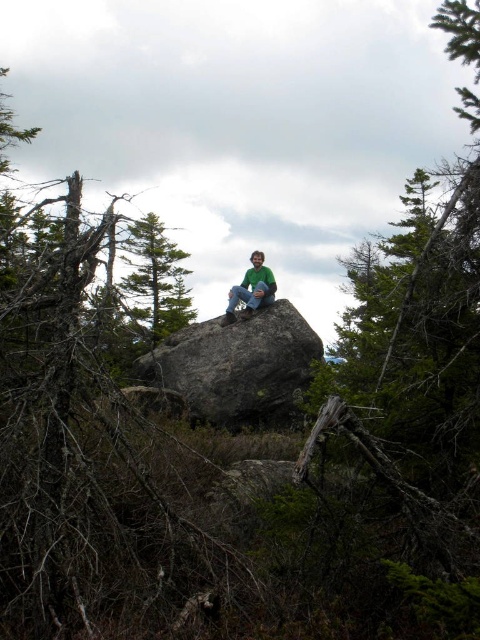
Is brown bark tree at center bigger than green textured pine tree at center?

Indeed, brown bark tree at center has a larger size compared to green textured pine tree at center.

Is point (154, 452) positioned before point (180, 291)?

Yes, it is.

Where is `brown bark tree at center`? This screenshot has height=640, width=480. brown bark tree at center is located at coordinates (80, 445).

Does brown bark tree at center come in front of gray rough boulder at center?

Yes, it is in front of gray rough boulder at center.

Which is above, brown bark tree at center or gray rough boulder at center?

brown bark tree at center

Which is in front, point (82, 262) or point (159, 358)?

Point (82, 262)

In order to click on brown bark tree at center in this screenshot , I will do `click(80, 445)`.

Is gray rough boulder at center further to camera compared to green textured pine tree at center?

Yes, it is behind green textured pine tree at center.

Can you confirm if gray rough boulder at center is smaller than green textured pine tree at center?

Indeed, gray rough boulder at center has a smaller size compared to green textured pine tree at center.

Does point (250, 422) come farther from viewer compared to point (168, 305)?

No, it is in front of (168, 305).

You are a GUI agent. You are given a task and a screenshot of the screen. Output one action in this format:
    pyautogui.click(x=<x>, y=<y>)
    Task: Click on the gray rough boulder at center
    
    Given the screenshot: What is the action you would take?
    pyautogui.click(x=237, y=365)